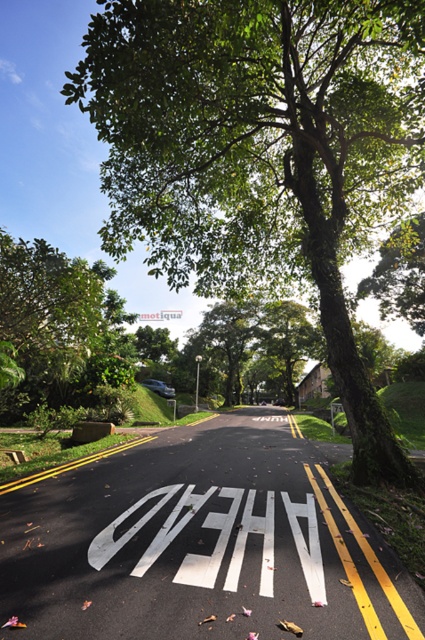
Between point (399, 61) and point (195, 381), which one is positioned behind?

The point (195, 381) is more distant.

This screenshot has height=640, width=425. What are the coordinates of `green leafy tree at center` in the screenshot? It's located at (261, 154).

Between green leafy tree at upper left and white plastic sign at center, which one appears on the right side from the viewer's perspective?

white plastic sign at center is more to the right.

Can you confirm if green leafy tree at upper left is wider than white plastic sign at center?

Indeed, green leafy tree at upper left has a greater width compared to white plastic sign at center.

Measure the distance between green leafy tree at upper left and camera.

They are 38.49 feet apart.

In order to click on green leafy tree at upper left in this screenshot , I will do `click(59, 328)`.

Is point (394, 54) behind point (91, 324)?

No, it is in front of (91, 324).

How much distance is there between green leafy tree at center and green leafy tree at upper left?

green leafy tree at center is 7.21 meters away from green leafy tree at upper left.

Is point (175, 44) more distant than point (116, 305)?

No, (175, 44) is in front of (116, 305).

Find the location of a particular element. This screenshot has height=640, width=425. green leafy tree at center is located at coordinates (261, 154).